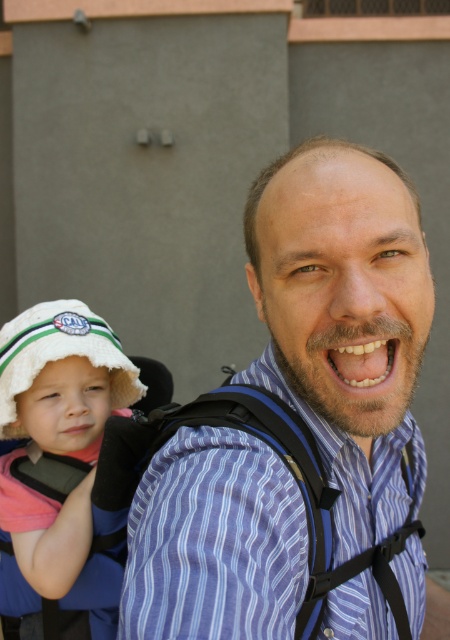
Does blue striped shirt at center have a greater height compared to white cotton hat at left?

No.

Is point (133, 634) farther from camera compared to point (31, 525)?

That is False.

Find the location of `blue striped shirt at center`. blue striped shirt at center is located at coordinates (215, 541).

Locate an element on the screen. Image resolution: width=450 pixels, height=640 pixels. blue striped shirt at center is located at coordinates (215, 541).

Between blue striped shirt at center and smooth blue shirt at center, which one appears on the left side from the viewer's perspective?

blue striped shirt at center

What do you see at coordinates (215, 541) in the screenshot? I see `blue striped shirt at center` at bounding box center [215, 541].

Who is more forward, (352, 547) or (341, 198)?

Positioned in front is point (341, 198).

The image size is (450, 640). I want to click on blue striped shirt at center, so click(215, 541).

Which is more to the left, smooth blue shirt at center or white cotton hat at left?

white cotton hat at left

Is point (324, 196) in front of point (31, 433)?

Yes, point (324, 196) is closer to viewer.

At what (x,y) coordinates should I click in order to perform the action: click on smooth blue shirt at center. Please return your answer as a coordinate pair (x, y). The image size is (450, 640). Looking at the image, I should click on (342, 282).